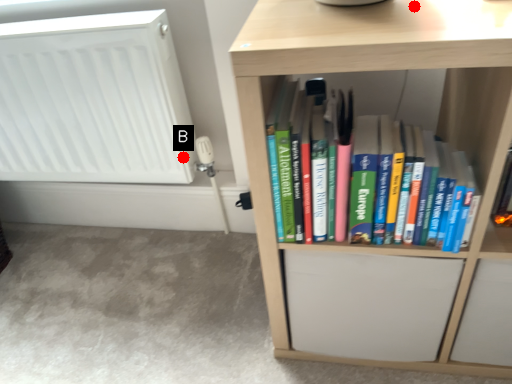
Question: Two points are circled on the image, labeled by A and B beside each circle. Among these points, which one is nearest to the camera?

Choices:
 (A) A is closer
 (B) B is closer

Answer: (A)